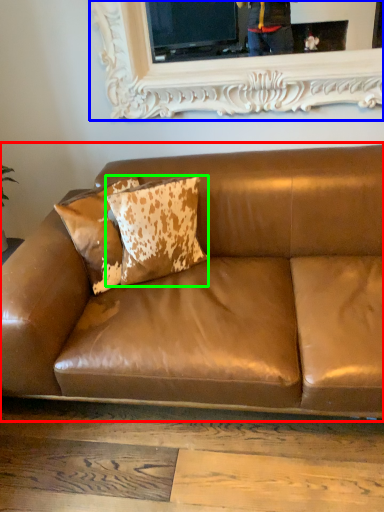
Question: Which object is the farthest from studio couch (highlighted by a red box)? Choose among these: picture frame (highlighted by a blue box) or pillow (highlighted by a green box).

Choices:
 (A) picture frame
 (B) pillow

Answer: (A)